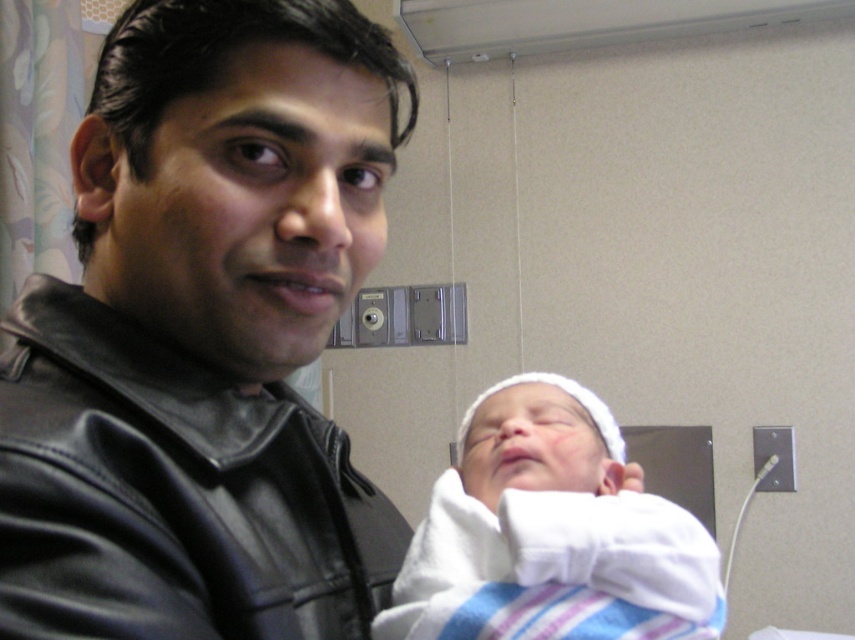
You are a nurse in a hospital room. You need to place a medical device on the white soft cloth at center without it touching the black leather jacket at left. Is the space between them sufficient?

The black leather jacket at left is above the white soft cloth at center, so there is enough vertical space to place the medical device on the white soft cloth at center without it touching the jacket.

You are a photographer in the hospital room. You need to place a small sticker on the black leather jacket at left. The sticker must be placed at the exact coordinates of point [172,493]. Can you confirm if this point is located on the black leather jacket at left?

Yes, the point [172,493] is on the black leather jacket at left, so the sticker can be placed there.

You are a photographer setting up a shoot in this hospital room. You need to ensure that the black leather jacket at left and the white soft cloth at center are both visible in the frame. Given their heights, which object should you position closer to the camera to maintain both in the shot without cropping?

The black leather jacket at left is taller than the white soft cloth at center, so positioning the taller black leather jacket at left closer to the camera will help ensure both objects remain visible without cropping.